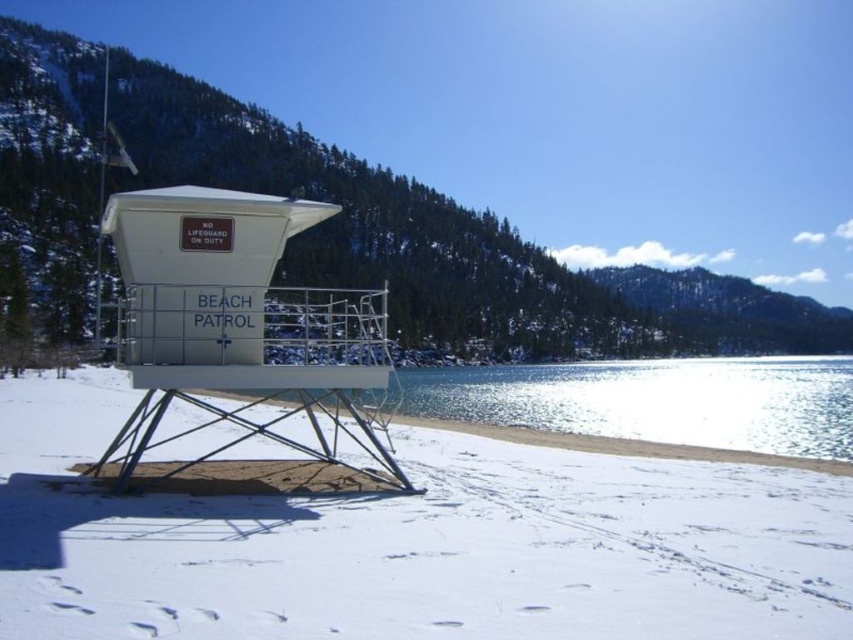
You are planning to build a snowman using the white powdery snow at lower center and need to know if there is enough snow. The snowman requires a base that is taller than the glistening ice water at center. Is there sufficient snow available?

The white powdery snow at lower center has a lesser height compared to glistening ice water at center, so there is not enough snow to build a base taller than the glistening ice water at center.

You are standing at the edge of the lake and want to walk towards the two points marked on the image. Which point, point (688, 518) or point (735, 432), will you reach first?

Point (688, 518) is closer to the viewer than point (735, 432), so you will reach point (688, 518) first.

You are standing at the edge of the lake and see the white powdery snow at lower center and the glistening ice water at center. Which surface would you choose to walk on if you want to stay above the ice?

The white powdery snow at lower center is located above the glistening ice water at center, so walking on the white powdery snow at lower center would keep you above the ice.